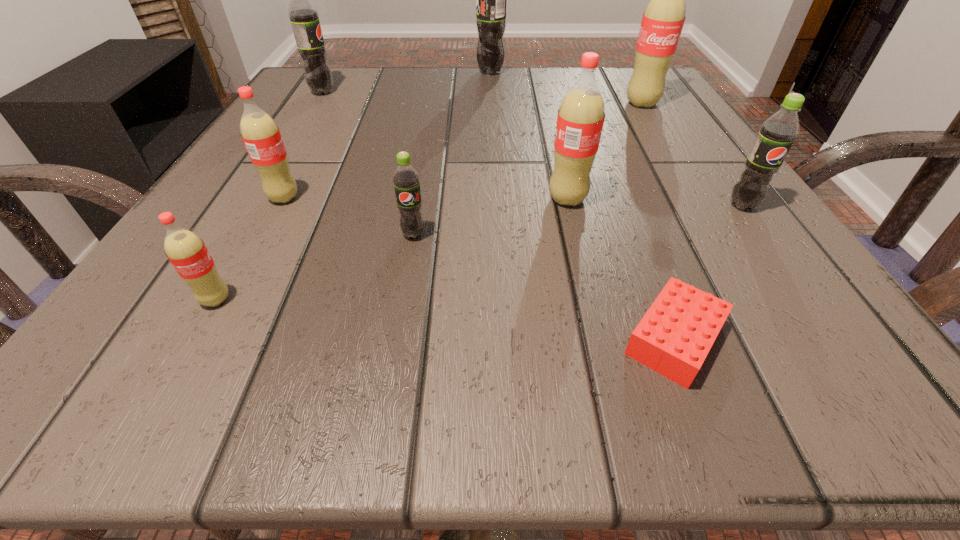
The width and height of the screenshot is (960, 540). In order to click on the farthest soda in this screenshot , I will do `click(491, 0)`.

Image resolution: width=960 pixels, height=540 pixels. I want to click on the fifth object from left to right, so click(x=491, y=0).

Find the location of a particular element. This screenshot has width=960, height=540. the rightmost red soda is located at coordinates pyautogui.click(x=663, y=19).

Find the location of a particular element. The image size is (960, 540). the farthest red soda is located at coordinates (663, 19).

Where is `the second biggest red soda`? The width and height of the screenshot is (960, 540). the second biggest red soda is located at coordinates (581, 115).

Locate an element on the screen. This screenshot has height=540, width=960. the third red soda from left to right is located at coordinates (581, 115).

You are a GUI agent. You are given a task and a screenshot of the screen. Output one action in this format:
    pyautogui.click(x=<x>, y=<y>)
    Task: Click on the second farthest green soda
    This screenshot has height=540, width=960.
    Given the screenshot: What is the action you would take?
    pyautogui.click(x=304, y=17)

Where is `the leftmost green soda`? Image resolution: width=960 pixels, height=540 pixels. the leftmost green soda is located at coordinates (304, 17).

The width and height of the screenshot is (960, 540). In order to click on the second smallest red soda in this screenshot , I will do `click(261, 136)`.

This screenshot has height=540, width=960. I want to click on the third biggest green soda, so click(x=777, y=133).